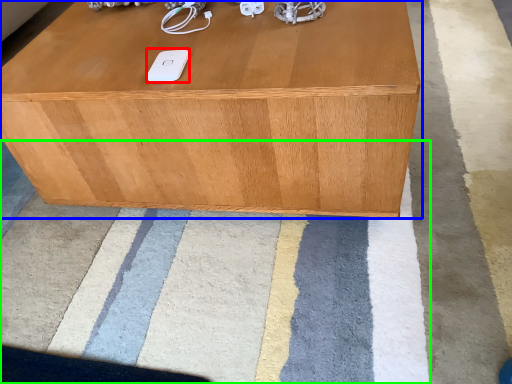
Question: Estimate the real-world distances between objects in this image. Which object is farther from ipod (highlighted by a red box), table (highlighted by a blue box) or mat (highlighted by a green box)?

Choices:
 (A) table
 (B) mat

Answer: (B)